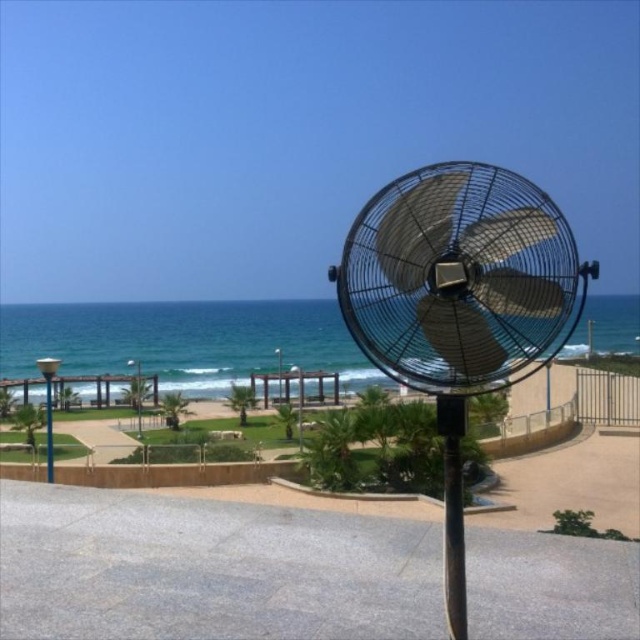
Is black matte pole at center below metallic pole at left?

Incorrect, black matte pole at center is not positioned below metallic pole at left.

Can you confirm if black matte pole at center is positioned to the left of metallic pole at left?

In fact, black matte pole at center is to the right of metallic pole at left.

Locate an element on the screen. Image resolution: width=640 pixels, height=640 pixels. black matte pole at center is located at coordinates (452, 512).

Can you confirm if metallic black fan at center is wider than metallic pole at left?

No.

Can you confirm if metallic black fan at center is thinner than metallic pole at left?

Yes, metallic black fan at center is thinner than metallic pole at left.

You are a GUI agent. You are given a task and a screenshot of the screen. Output one action in this format:
    pyautogui.click(x=<x>, y=<y>)
    Task: Click on the metallic black fan at center
    The height and width of the screenshot is (640, 640).
    Given the screenshot: What is the action you would take?
    pyautogui.click(x=460, y=301)

Can you confirm if metallic black fan at center is shorter than black matte pole at center?

Incorrect, metallic black fan at center's height does not fall short of black matte pole at center's.

Is point (508, 321) farther from camera compared to point (442, 422)?

No.

At what (x,y) coordinates should I click in order to perform the action: click on metallic black fan at center. Please return your answer as a coordinate pair (x, y). The image size is (640, 640). Looking at the image, I should click on (460, 301).